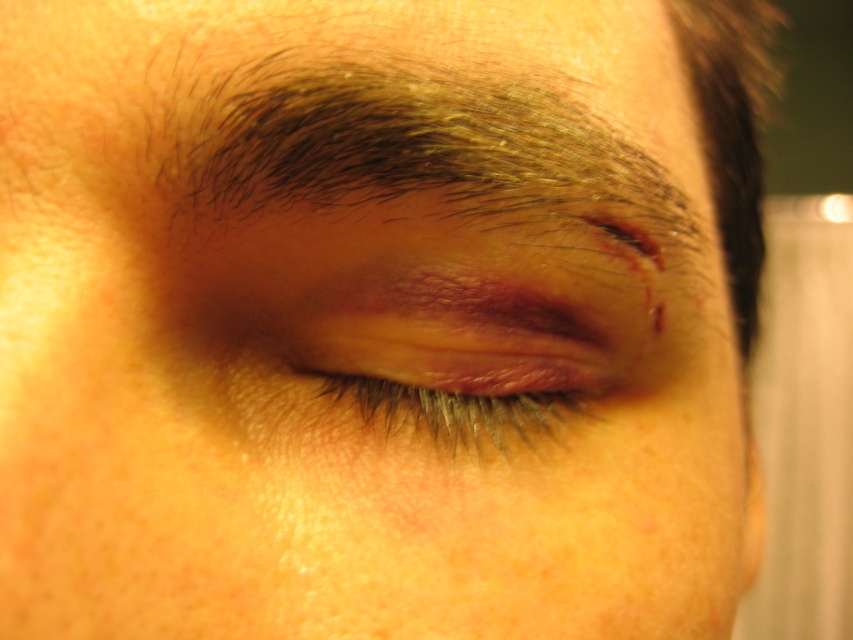
You are a medical professional examining the patient. You notice two points of interest on their face. The first point is at coordinates point (347,51), and the second is at point (515,424). Which point is closer to the viewer?

Point (347,51) is in front of point (515,424), so the first point is closer to the viewer.

You are a medical professional examining the image of a patient with injuries. The patient has dark brown hair at upper center and swollen skin at center. Which of these two areas is larger in size?

The dark brown hair at upper center is bigger than swollen skin at center according to the description.

You are a medical professional examining the patient. You notice a point at coordinates (412, 147). What is located at this point?

At point (412, 147) lies dark brown hair at upper center.